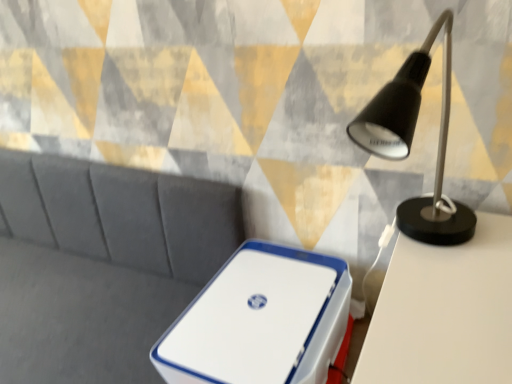
Where is `empty space that is ontop of white plastic storage box at center (from a real-world perspective)`? This screenshot has width=512, height=384. empty space that is ontop of white plastic storage box at center (from a real-world perspective) is located at coordinates (262, 312).